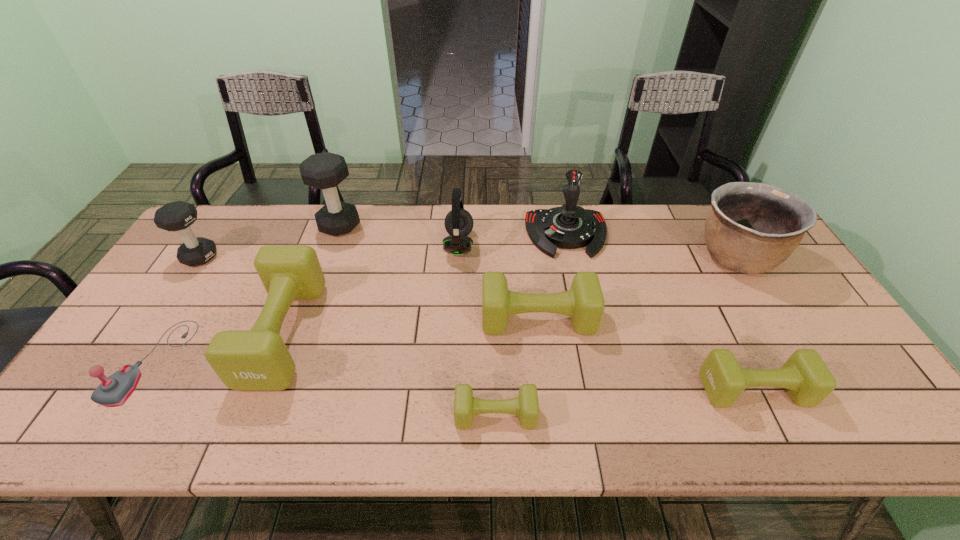
Locate an element on the screen. free space located 0.270m on the left of the pottery is located at coordinates (606, 257).

Locate an element on the screen. Image resolution: width=960 pixels, height=540 pixels. vacant area situated on the ear cups of the black headset is located at coordinates (508, 245).

This screenshot has height=540, width=960. In order to click on free spot located 0.280m on the right of the leftmost dumbbell in this screenshot , I will do (308, 257).

The height and width of the screenshot is (540, 960). In order to click on vacant space located on the left of the leftmost olive dumbbell in this screenshot , I will do `click(198, 332)`.

Image resolution: width=960 pixels, height=540 pixels. I want to click on vacant space located on the front of the third smallest olive dumbbell, so click(x=551, y=433).

Where is `vacant region located 0.170m on the back of the rightmost dumbbell`? vacant region located 0.170m on the back of the rightmost dumbbell is located at coordinates (718, 318).

You are a GUI agent. You are given a task and a screenshot of the screen. Output one action in this format:
    pyautogui.click(x=<x>, y=<y>)
    Task: Click on the blank area located on the back of the gray joystick
    The width and height of the screenshot is (960, 540).
    Given the screenshot: What is the action you would take?
    pyautogui.click(x=202, y=281)

At what (x,y) coordinates should I click in order to perform the action: click on blank space located 0.070m on the left of the shortest dumbbell. Please return your answer as a coordinate pair (x, y). This screenshot has height=540, width=960. Looking at the image, I should click on (424, 415).

Locate an element on the screen. This screenshot has width=960, height=540. joystick present at the far edge is located at coordinates (570, 226).

You are a GUI agent. You are given a task and a screenshot of the screen. Output one action in this format:
    pyautogui.click(x=<x>, y=<y>)
    Task: Click on the pottery positioned at the far edge
    
    Given the screenshot: What is the action you would take?
    pyautogui.click(x=751, y=228)